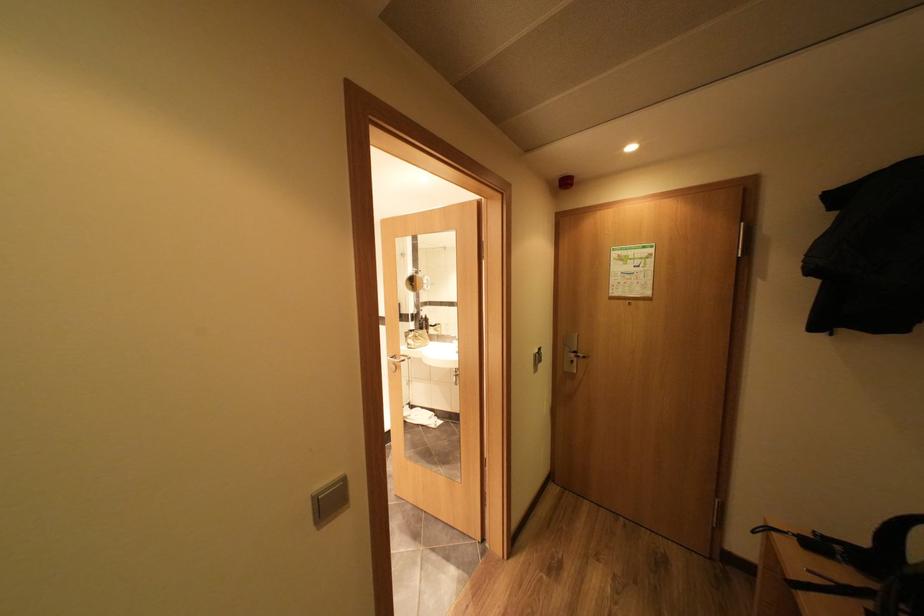
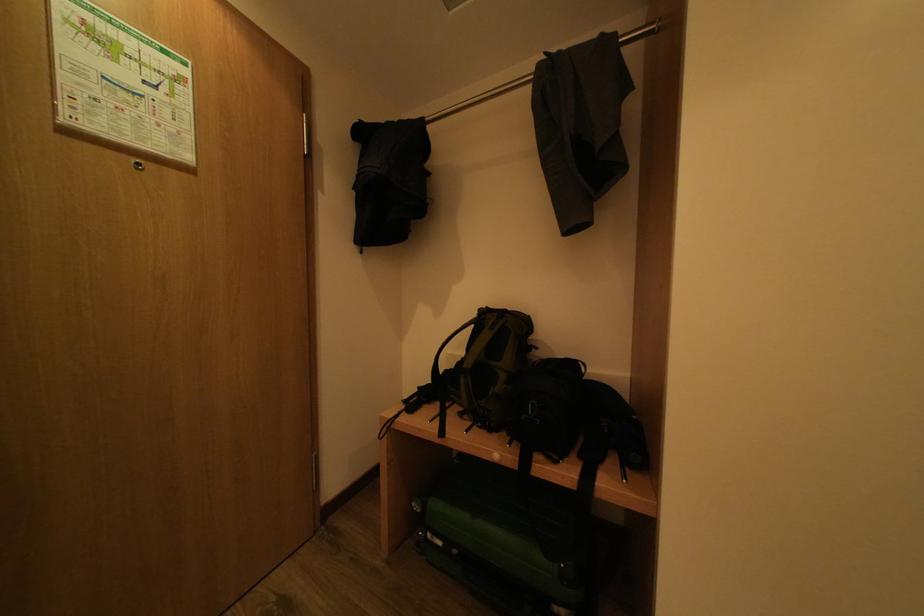
Question: How did the camera likely rotate?

Choices:
 (A) Left
 (B) Right
 (C) Up
 (D) Down

Answer: (B)